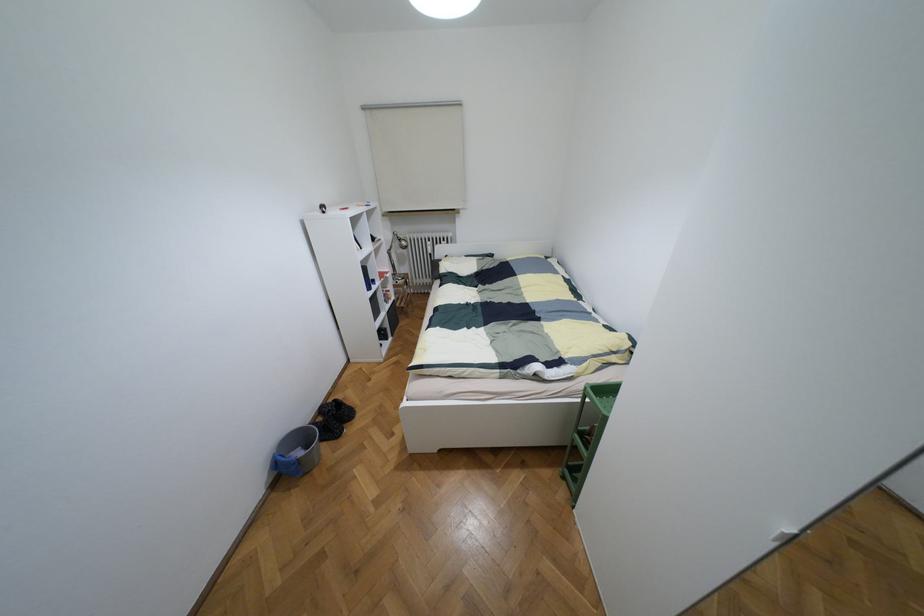
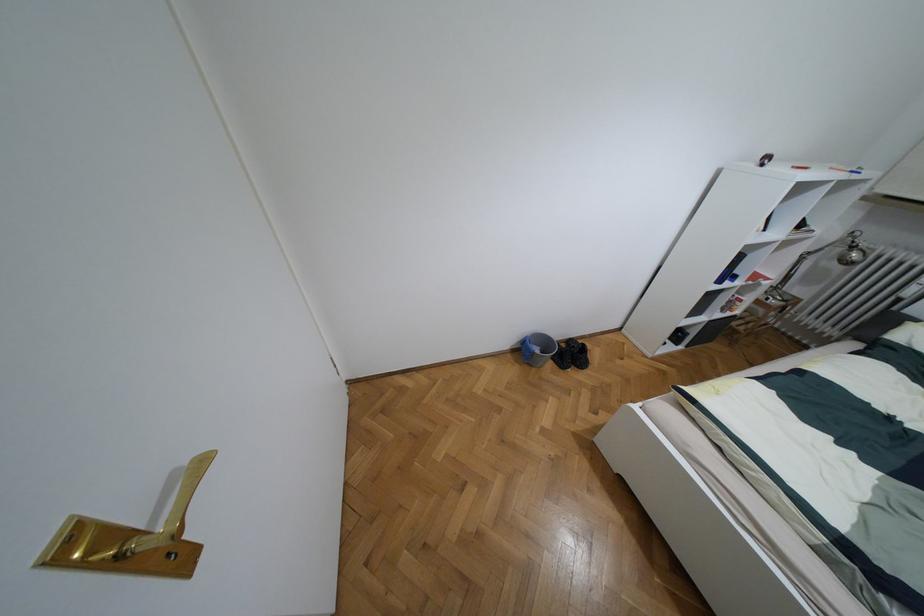
The point at [298,453] is marked in the first image. Where is the corresponding point in the second image?

(536, 350)